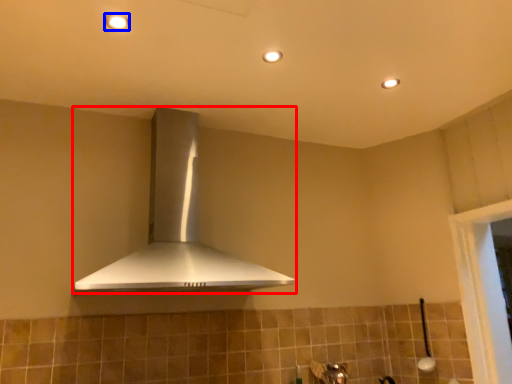
Question: Which object appears farthest to the camera in this image, home appliance (highlighted by a red box) or light fixture (highlighted by a blue box)?

Choices:
 (A) home appliance
 (B) light fixture

Answer: (B)